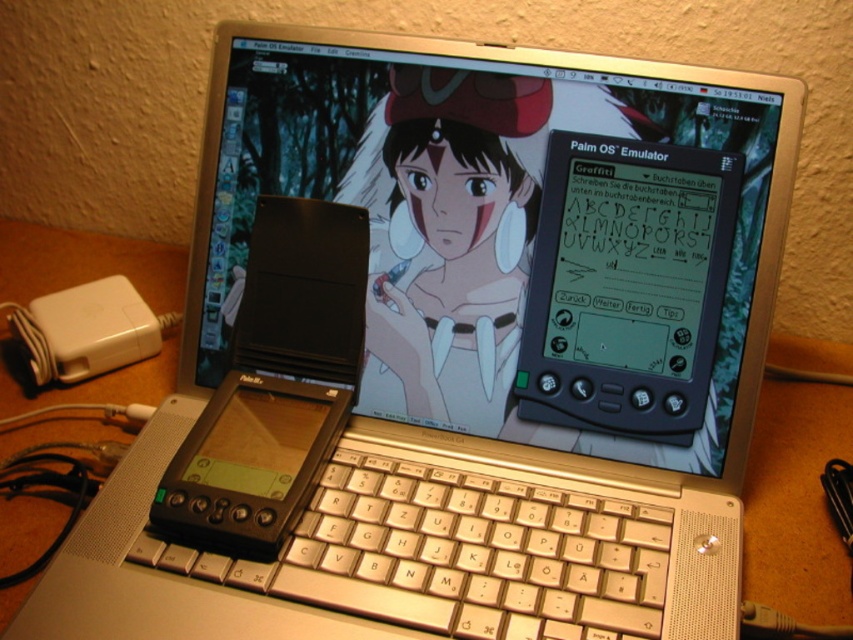
Question: Can you confirm if black plastic palm pilot at center is positioned to the right of white plastic power adapter at lower left?

Choices:
 (A) yes
 (B) no

Answer: (A)

Question: Is black plastic palm pilot at center to the right of white plastic power adapter at lower left from the viewer's perspective?

Choices:
 (A) no
 (B) yes

Answer: (B)

Question: Does black plastic palm pilot at center appear under white plastic power adapter at lower left?

Choices:
 (A) no
 (B) yes

Answer: (B)